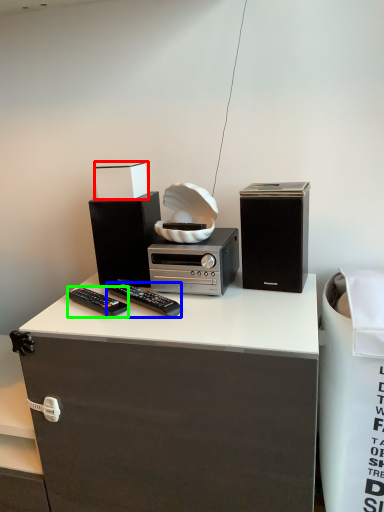
Question: Which object is the farthest from box (highlighted by a red box)? Choose among these: remote control (highlighted by a blue box) or remote control (highlighted by a green box).

Choices:
 (A) remote control
 (B) remote control

Answer: (B)